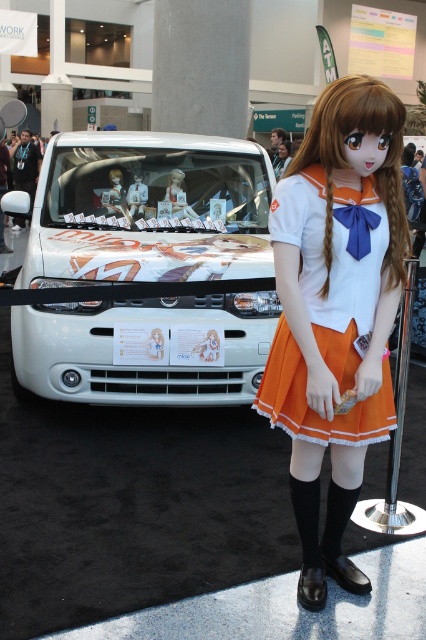
Question: Can you confirm if orange satin skirt at center is smaller than orange satin dress at right?

Choices:
 (A) no
 (B) yes

Answer: (A)

Question: Which point is closer to the camera?

Choices:
 (A) orange satin skirt at center
 (B) matte plastic doll at center

Answer: (A)

Question: Can you confirm if orange satin skirt at center is positioned above matte plastic doll at center?

Choices:
 (A) no
 (B) yes

Answer: (A)

Question: Does orange satin dress at right have a lesser width compared to matte plastic doll at center?

Choices:
 (A) no
 (B) yes

Answer: (A)

Question: Which object is the closest to the orange satin dress at right?

Choices:
 (A) matte plastic doll at center
 (B) orange satin skirt at center
 (C) white glossy car at center

Answer: (B)

Question: Estimate the real-world distances between objects in this image. Which object is farther from the matte plastic doll at center?

Choices:
 (A) white glossy car at center
 (B) orange satin skirt at center
 (C) orange satin dress at right

Answer: (C)